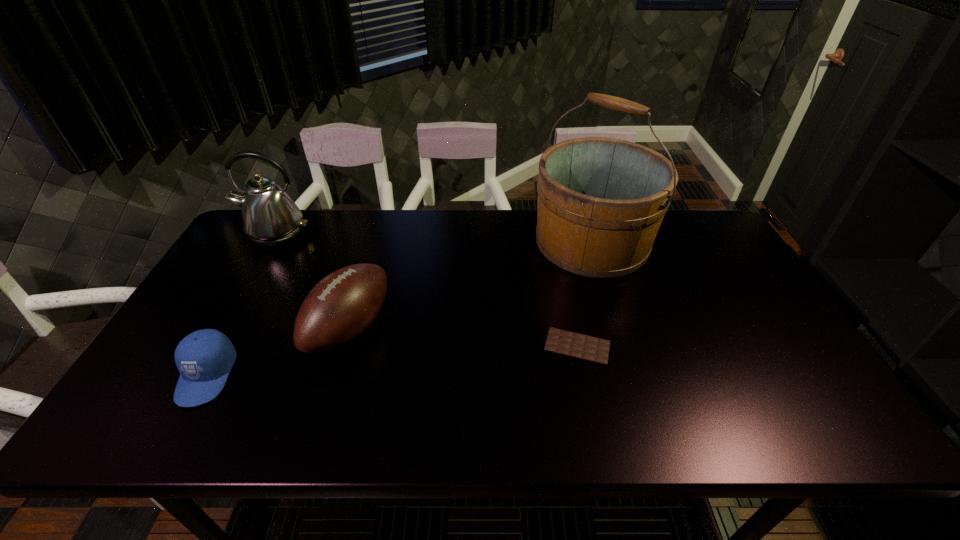
You are a GUI agent. You are given a task and a screenshot of the screen. Output one action in this format:
    pyautogui.click(x=<x>, y=<y>)
    Task: Click on the vacant space in between the shortest object and the second tallest object
    
    Given the screenshot: What is the action you would take?
    pyautogui.click(x=426, y=290)

I want to click on unoccupied area between the kettle and the chocolate bar, so click(426, 290).

The height and width of the screenshot is (540, 960). What are the coordinates of `free space between the third tallest object and the fourth tallest object` in the screenshot? It's located at (278, 352).

Image resolution: width=960 pixels, height=540 pixels. I want to click on free space between the chocolate bar and the fourth shortest object, so click(426, 290).

Select which object is the second closest to the cap. Please provide its 2D coordinates. Your answer should be formatted as a tuple, i.e. [(x, y)], where the tuple contains the x and y coordinates of a point satisfying the conditions above.

[(270, 218)]

Where is `object identified as the closest to the shortest object`? object identified as the closest to the shortest object is located at coordinates (601, 201).

The height and width of the screenshot is (540, 960). I want to click on vacant space that satisfies the following two spatial constraints: 1. from the spout of the fourth shortest object; 2. on the right side of the third object from left to right, so click(x=223, y=328).

Identify the location of free space that satisfies the following two spatial constraints: 1. on the back side of the chocolate bar; 2. on the left side of the tallest object. The width and height of the screenshot is (960, 540). (556, 242).

The image size is (960, 540). I want to click on free space in the image that satisfies the following two spatial constraints: 1. from the spout of the kettle; 2. on the left side of the chocolate bar, so [x=212, y=346].